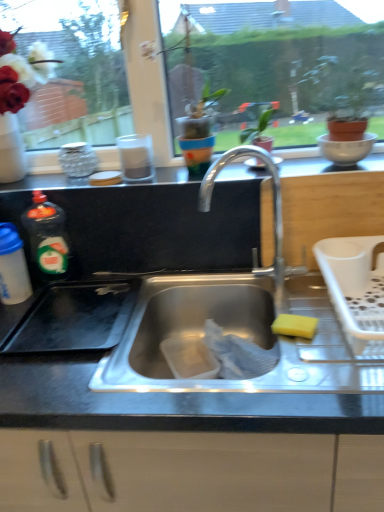
Question: Considering the relative positions of white plastic dish rack at right and yellow sponge at sink right in the image provided, is white plastic dish rack at right to the right of yellow sponge at sink right from the viewer's perspective?

Choices:
 (A) yes
 (B) no

Answer: (A)

Question: Is yellow sponge at sink right located within white plastic dish rack at right?

Choices:
 (A) no
 (B) yes

Answer: (A)

Question: Is white plastic dish rack at right to the left of yellow sponge at sink right from the viewer's perspective?

Choices:
 (A) yes
 (B) no

Answer: (B)

Question: From a real-world perspective, is white plastic dish rack at right below yellow sponge at sink right?

Choices:
 (A) no
 (B) yes

Answer: (A)

Question: From the image's perspective, does white plastic dish rack at right appear higher than yellow sponge at sink right?

Choices:
 (A) yes
 (B) no

Answer: (A)

Question: In the image, is white glossy bowl at upper right on the left side or the right side of white plastic dish rack at right?

Choices:
 (A) right
 (B) left

Answer: (A)

Question: Is white glossy bowl at upper right in front of or behind white plastic dish rack at right in the image?

Choices:
 (A) behind
 (B) front

Answer: (A)

Question: Looking at the image, does white glossy bowl at upper right seem bigger or smaller compared to white plastic dish rack at right?

Choices:
 (A) big
 (B) small

Answer: (B)

Question: From the image's perspective, is white glossy bowl at upper right located above or below white plastic dish rack at right?

Choices:
 (A) above
 (B) below

Answer: (A)

Question: From a real-world perspective, relative to green matte plant at upper right, is translucent plastic bottle at left, arranged as the 2th bottle when viewed from the left, vertically above or below?

Choices:
 (A) above
 (B) below

Answer: (B)

Question: Is translucent plastic bottle at left, placed as the 1th bottle when sorted from right to left, taller or shorter than green matte plant at upper right?

Choices:
 (A) tall
 (B) short

Answer: (A)

Question: From the image's perspective, is translucent plastic bottle at left, placed as the 1th bottle when sorted from right to left, positioned above or below green matte plant at upper right?

Choices:
 (A) above
 (B) below

Answer: (B)

Question: Is translucent plastic bottle at left, placed as the 1th bottle when sorted from right to left, spatially inside green matte plant at upper right, or outside of it?

Choices:
 (A) outside
 (B) inside

Answer: (A)

Question: From the image's perspective, is black matte counter top at upper center located above or below translucent plastic bottle at left, marked as the first bottle in a left-to-right arrangement?

Choices:
 (A) above
 (B) below

Answer: (A)

Question: In the image, is black matte counter top at upper center positioned in front of or behind translucent plastic bottle at left, marked as the first bottle in a left-to-right arrangement?

Choices:
 (A) front
 (B) behind

Answer: (B)